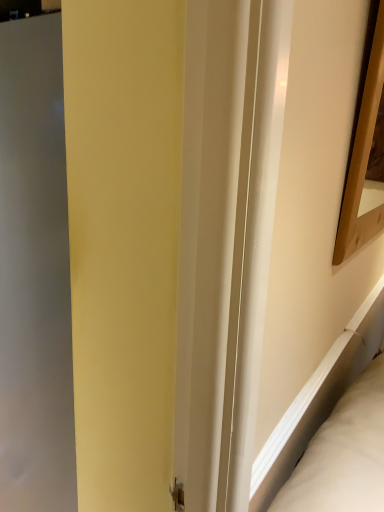
Question: Relative to matte gray screen door at left, is wooden picture frame at upper right in front or behind?

Choices:
 (A) behind
 (B) front

Answer: (B)

Question: From a real-world perspective, is wooden picture frame at upper right positioned above or below matte gray screen door at left?

Choices:
 (A) below
 (B) above

Answer: (B)

Question: From the image's perspective, is wooden picture frame at upper right positioned above or below matte gray screen door at left?

Choices:
 (A) below
 (B) above

Answer: (B)

Question: Choose the correct answer: Is matte gray screen door at left inside wooden picture frame at upper right or outside it?

Choices:
 (A) inside
 (B) outside

Answer: (B)

Question: Is matte gray screen door at left taller or shorter than wooden picture frame at upper right?

Choices:
 (A) short
 (B) tall

Answer: (B)

Question: From the image's perspective, is matte gray screen door at left positioned above or below wooden picture frame at upper right?

Choices:
 (A) below
 (B) above

Answer: (A)

Question: Looking at the image, does matte gray screen door at left seem bigger or smaller compared to wooden picture frame at upper right?

Choices:
 (A) big
 (B) small

Answer: (A)